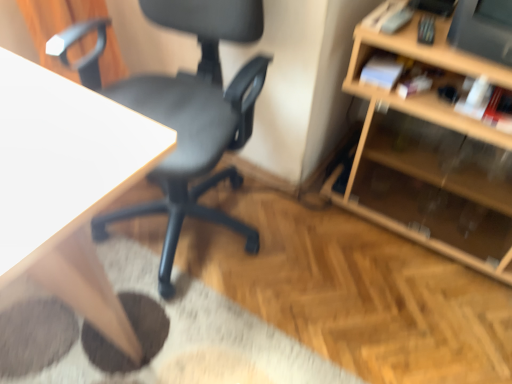
Measure the distance between white wood desk at upper left and camera.

They are 23.31 inches apart.

This screenshot has height=384, width=512. What do you see at coordinates (67, 185) in the screenshot?
I see `white wood desk at upper left` at bounding box center [67, 185].

The height and width of the screenshot is (384, 512). What are the coordinates of `black plastic chair at center` in the screenshot? It's located at (184, 111).

Identify the location of white wood desk at upper left. (67, 185).

Is wooden shelf at right positioned with its back to black plastic chair at center?

wooden shelf at right is not turned away from black plastic chair at center.

Image resolution: width=512 pixels, height=384 pixels. Find the location of `shelf below the black plastic chair at center (from the image's perspective)`. shelf below the black plastic chair at center (from the image's perspective) is located at coordinates (433, 153).

Does wooden shelf at right lie behind black plastic chair at center?

Yes, the depth of wooden shelf at right is greater than that of black plastic chair at center.

Can you confirm if wooden shelf at right is positioned to the left of black plastic chair at center?

No, wooden shelf at right is not to the left of black plastic chair at center.

From the image's perspective, which one is positioned lower, black plastic chair at center or white wood desk at upper left?

white wood desk at upper left.

Are black plastic chair at center and white wood desk at upper left located far from each other?

No, black plastic chair at center is not far from white wood desk at upper left.

Who is taller, black plastic chair at center or white wood desk at upper left?

black plastic chair at center.

From the picture: Is black plastic chair at center completely or partially outside of white wood desk at upper left?

black plastic chair at center is positioned outside white wood desk at upper left.

Considering the relative sizes of black plastic chair at center and wooden shelf at right in the image provided, is black plastic chair at center smaller than wooden shelf at right?

No.

Which is behind, black plastic chair at center or wooden shelf at right?

wooden shelf at right is further from the camera.

Could you tell me if black plastic chair at center is turned towards wooden shelf at right?

No, black plastic chair at center is not oriented towards wooden shelf at right.

Locate an element on the screen. shelf below the black plastic chair at center (from the image's perspective) is located at coordinates (433, 153).

From a real-world perspective, is white wood desk at upper left under wooden shelf at right?

No, from a real-world perspective, white wood desk at upper left is not under wooden shelf at right.

Considering the positions of objects white wood desk at upper left and wooden shelf at right in the image provided, who is more to the left, white wood desk at upper left or wooden shelf at right?

white wood desk at upper left is more to the left.

Would you say wooden shelf at right is part of white wood desk at upper left's contents?

No, wooden shelf at right is not a part of white wood desk at upper left.

Based on the photo, is white wood desk at upper left directly adjacent to wooden shelf at right?

No, white wood desk at upper left is not next to wooden shelf at right.

Which is behind, point (90, 92) or point (248, 118)?

The point (248, 118) is behind.

From the image's perspective, is white wood desk at upper left under black plastic chair at center?

Correct, white wood desk at upper left appears lower than black plastic chair at center in the image.

Where is `desk that appears in front of the black plastic chair at center`? The height and width of the screenshot is (384, 512). desk that appears in front of the black plastic chair at center is located at coordinates (67, 185).

Looking at this image, can you tell me how much white wood desk at upper left and black plastic chair at center differ in facing direction?

The angular difference between white wood desk at upper left and black plastic chair at center is 79.9 degrees.

From the image's perspective, is wooden shelf at right located above white wood desk at upper left?

Yes.

Which is in front, wooden shelf at right or white wood desk at upper left?

white wood desk at upper left is more forward.

Consider the image. Which of these two, wooden shelf at right or white wood desk at upper left, stands taller?

white wood desk at upper left.

There is a wooden shelf at right. Identify the location of chair above it (from a real-world perspective). The height and width of the screenshot is (384, 512). (184, 111).

Locate an element on the screen. This screenshot has height=384, width=512. chair that appears behind the white wood desk at upper left is located at coordinates (184, 111).

Estimate the real-world distances between objects in this image. Which object is closer to black plastic chair at center, white wood desk at upper left or wooden shelf at right?

Based on the image, white wood desk at upper left appears to be nearer to black plastic chair at center.

Considering their positions, is black plastic chair at center positioned further to white wood desk at upper left than wooden shelf at right?

wooden shelf at right is positioned further to the anchor white wood desk at upper left.

When comparing their distances from black plastic chair at center, does wooden shelf at right or white wood desk at upper left seem further?

wooden shelf at right is further to black plastic chair at center.

From the picture: Based on their spatial positions, is wooden shelf at right or black plastic chair at center further from white wood desk at upper left?

wooden shelf at right is positioned further to the anchor white wood desk at upper left.

Based on their spatial positions, is white wood desk at upper left or black plastic chair at center closer to wooden shelf at right?

Based on the image, black plastic chair at center appears to be nearer to wooden shelf at right.

From the image, which object appears to be farther from wooden shelf at right, black plastic chair at center or white wood desk at upper left?

white wood desk at upper left is positioned further to the anchor wooden shelf at right.

You are a GUI agent. You are given a task and a screenshot of the screen. Output one action in this format:
    pyautogui.click(x=<x>, y=<y>)
    Task: Click on the chair between white wood desk at upper left and wooden shelf at right from left to right
    The width and height of the screenshot is (512, 384).
    Given the screenshot: What is the action you would take?
    point(184,111)